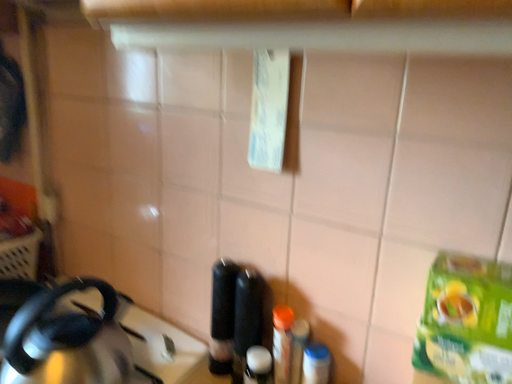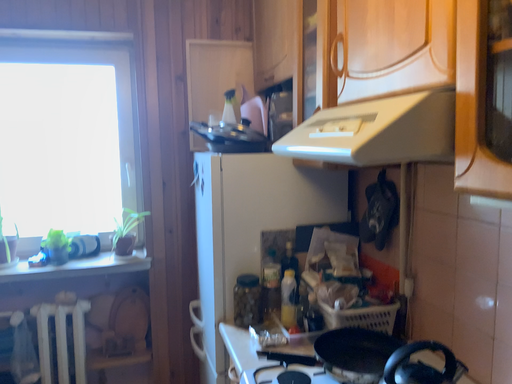
Question: How did the camera likely rotate when shooting the video?

Choices:
 (A) rotated downward
 (B) rotated upward

Answer: (B)